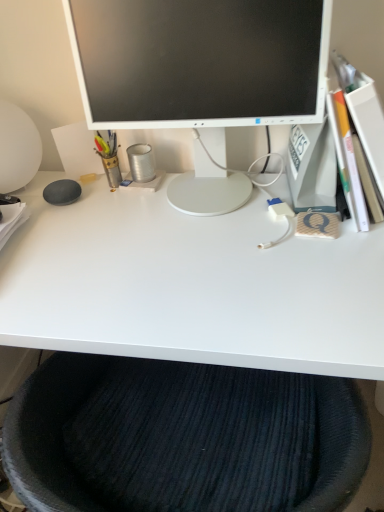
Question: Considering the relative sizes of dark blue textured cushion at lower center and metallic pen holder at left, which is the first stationery from left to right, in the image provided, is dark blue textured cushion at lower center thinner than metallic pen holder at left, which is the first stationery from left to right,?

Choices:
 (A) yes
 (B) no

Answer: (B)

Question: Is dark blue textured cushion at lower center in front of metallic pen holder at left, which is the first stationery from left to right?

Choices:
 (A) no
 (B) yes

Answer: (B)

Question: Is metallic pen holder at left, which appears as the second stationery when viewed from the right, located within dark blue textured cushion at lower center?

Choices:
 (A) no
 (B) yes

Answer: (A)

Question: Can you confirm if dark blue textured cushion at lower center is positioned to the left of metallic pen holder at left, which is the first stationery from left to right?

Choices:
 (A) no
 (B) yes

Answer: (A)

Question: Is dark blue textured cushion at lower center taller than metallic pen holder at left, which appears as the second stationery when viewed from the right?

Choices:
 (A) yes
 (B) no

Answer: (A)

Question: Is dark blue textured cushion at lower center further to the viewer compared to metallic pen holder at left, which is the first stationery from left to right?

Choices:
 (A) no
 (B) yes

Answer: (A)

Question: Would you say metallic canister at center, which is the first stationery in right-to-left order, is outside white glossy desk at center?

Choices:
 (A) no
 (B) yes

Answer: (B)

Question: Is metallic canister at center, which is the first stationery in right-to-left order, at the right side of white glossy desk at center?

Choices:
 (A) no
 (B) yes

Answer: (A)

Question: Considering the relative positions of metallic canister at center, which is the first stationery in right-to-left order, and white glossy desk at center in the image provided, is metallic canister at center, which is the first stationery in right-to-left order, behind white glossy desk at center?

Choices:
 (A) yes
 (B) no

Answer: (A)

Question: Is metallic canister at center, the second stationery in the left-to-right sequence, next to white glossy desk at center and touching it?

Choices:
 (A) no
 (B) yes

Answer: (A)

Question: Is metallic canister at center, the second stationery in the left-to-right sequence, positioned before white glossy desk at center?

Choices:
 (A) yes
 (B) no

Answer: (B)

Question: Is metallic canister at center, the second stationery in the left-to-right sequence, oriented away from white glossy desk at center?

Choices:
 (A) yes
 (B) no

Answer: (B)

Question: From a real-world perspective, is metallic pen holder at left, which appears as the second stationery when viewed from the right, over white glossy monitor at center?

Choices:
 (A) yes
 (B) no

Answer: (B)